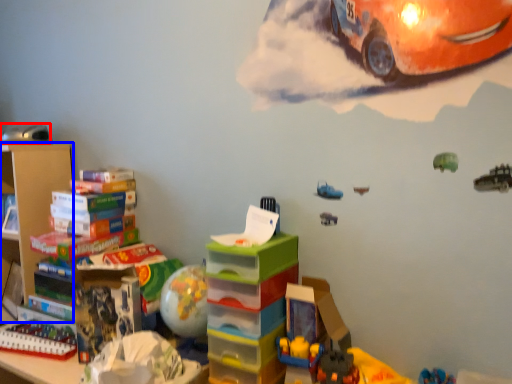
Question: Which object appears farthest to the camera in this image, toy (highlighted by a red box) or shelf (highlighted by a blue box)?

Choices:
 (A) toy
 (B) shelf

Answer: (A)